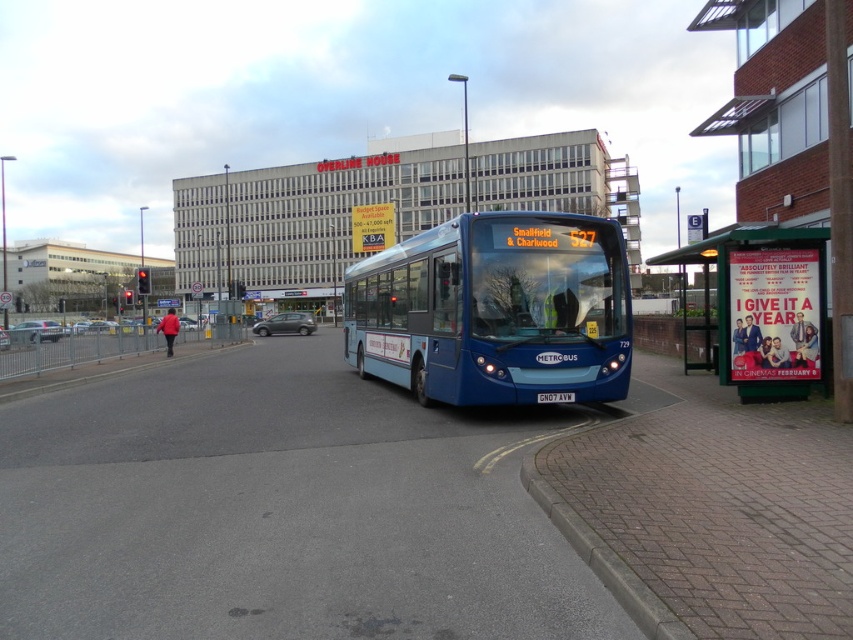
You are a pedestrian standing at the brick pavement at lower right and want to reach the metallic green bus stop at right. Which direction should you move to get there?

The brick pavement at lower right is in front of the metallic green bus stop at right, so you should move backward to reach the metallic green bus stop at right.

You are a pedestrian waiting at the bus stop and want to board the blue metallic bus at center. Is the bus positioned in a way that you can easily access it from the metallic green bus stop at right?

The blue metallic bus at center is below the metallic green bus stop at right, so it is positioned directly in front of or under the bus stop, making it easily accessible for boarding.

You are a delivery person trying to place a box on the brick pavement at lower right. The box is 10 cm tall. Can you place it there without it being hidden by the metallic green bus stop at right?

The brick pavement at lower right has a lesser height compared to metallic green bus stop at right, so the box placed there will not be hidden since the bus stop is taller but the question is about placement height. Wait, maybe the answer is yes because the pavement is lower, so the box can be placed there without being hidden by the taller bus stop.